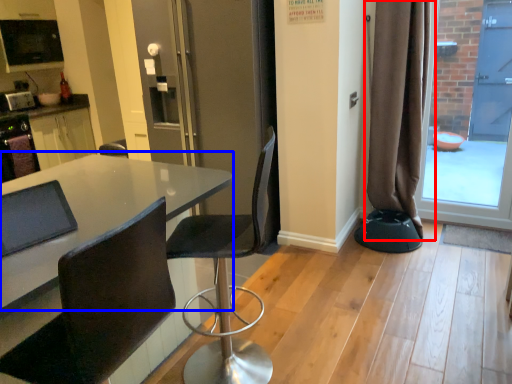
Question: Which point is further to the camera, curtain (highlighted by a red box) or table (highlighted by a blue box)?

Choices:
 (A) curtain
 (B) table

Answer: (A)